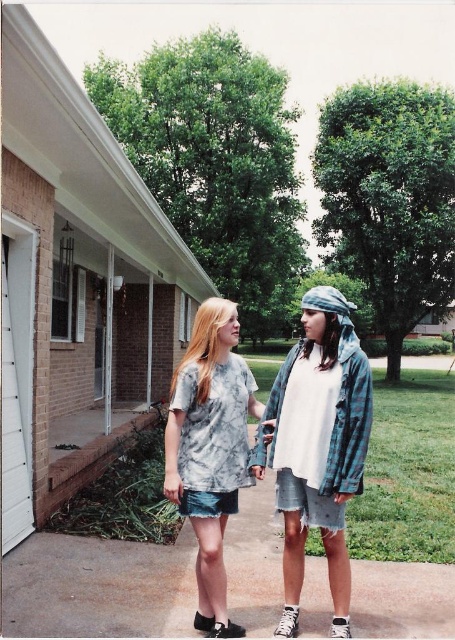
You are standing on the concrete pavement at lower center and want to walk towards the brick house. Which direction should you move to reach the brick house?

The concrete pavement at lower center is positioned at point (97, 588). Since the brick house is the main structure in the scene, you should move towards the house by walking forward from the concrete pavement at lower center.